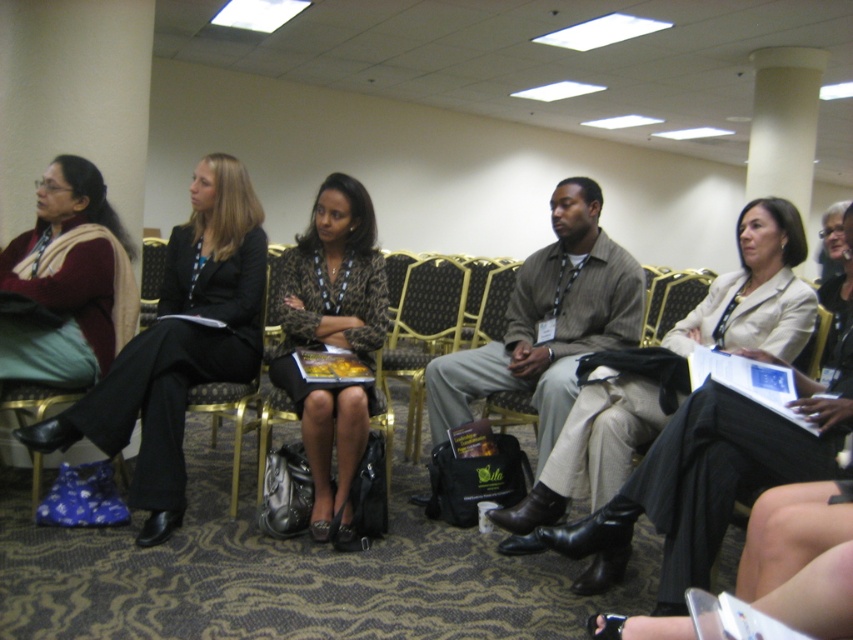
How much distance is there between beige fabric jacket at center and black fabric chair at center?

They are 1.26 meters apart.

Is point (614, 552) positioned after point (241, 413)?

No, it is not.

The height and width of the screenshot is (640, 853). Identify the location of beige fabric jacket at center. (755, 291).

How much distance is there between leopard print dress at center and gold-patterned chair at center?

The distance of leopard print dress at center from gold-patterned chair at center is 84.74 centimeters.

You are a GUI agent. You are given a task and a screenshot of the screen. Output one action in this format:
    pyautogui.click(x=<x>, y=<y>)
    Task: Click on the leopard print dress at center
    This screenshot has width=853, height=640.
    Given the screenshot: What is the action you would take?
    pyautogui.click(x=332, y=342)

At what (x,y) coordinates should I click in order to perform the action: click on leopard print dress at center. Please return your answer as a coordinate pair (x, y). Looking at the image, I should click on [x=332, y=342].

Which is more to the right, matte black suit at left or beige fabric jacket at center?

Positioned to the right is beige fabric jacket at center.

Based on the photo, does matte black suit at left appear on the right side of beige fabric jacket at center?

No, matte black suit at left is not to the right of beige fabric jacket at center.

Does point (218, 259) come in front of point (660, 392)?

No, (218, 259) is behind (660, 392).

At what (x,y) coordinates should I click in order to perform the action: click on matte black suit at left. Please return your answer as a coordinate pair (x, y). Looking at the image, I should click on (178, 342).